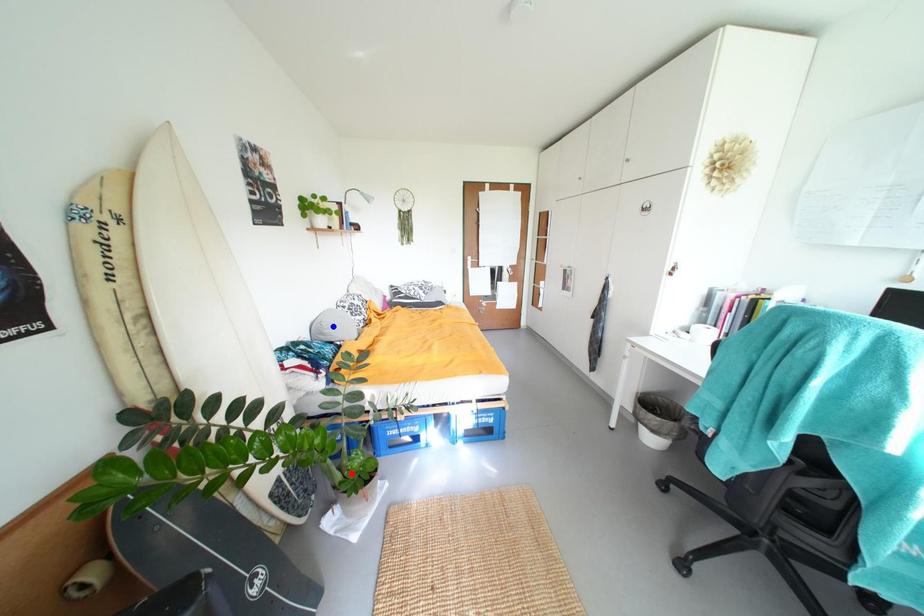
Question: Which of the two points in the image is closer to the camera?

Choices:
 (A) Blue point is closer.
 (B) Red point is closer.

Answer: (B)